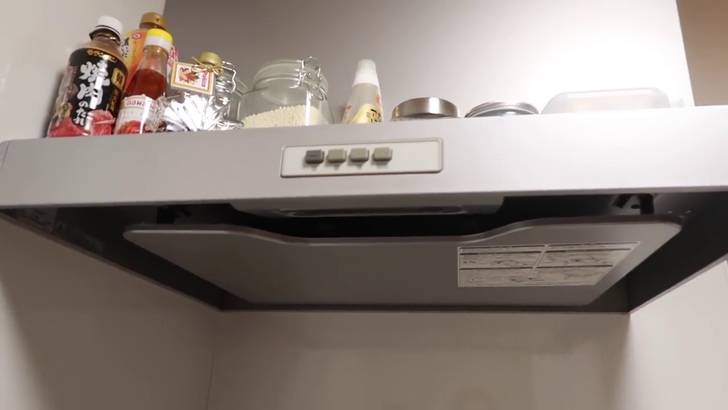
Find the location of a particular element. The width and height of the screenshot is (728, 410). glass container is located at coordinates (290, 99).